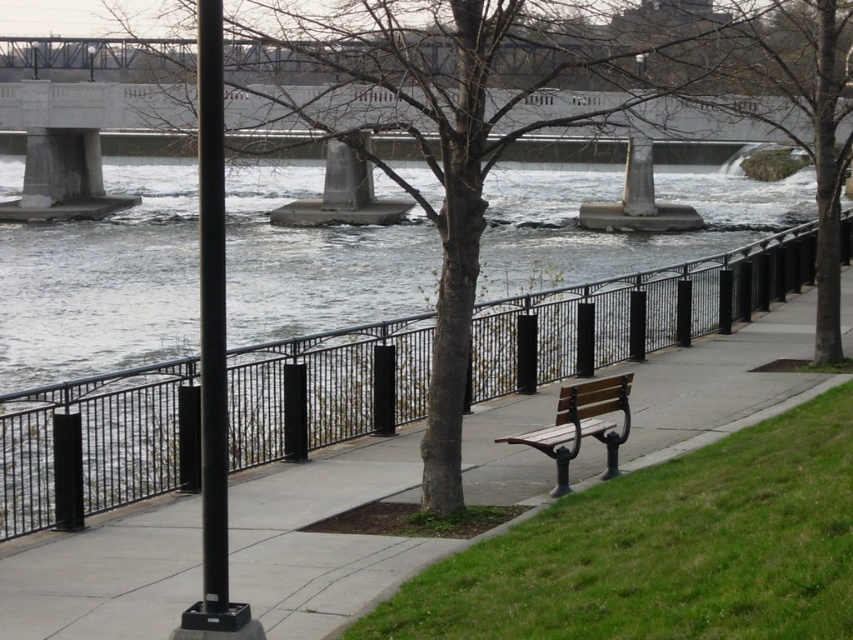
You are standing at the point marked by the coordinates point (630, 314) in the image. What object is directly in front of you?

The point (630, 314) indicates the black metal railing at center, so the object directly in front of you is the black metal railing at center.

You are standing on the riverside walkway and see two points marked in the image. Which point is closer to you, point (328, 378) or point (584, 390)?

Point (328, 378) is further to the camera than point (584, 390), so point (584, 390) is closer to you.

You are standing on the riverside walkway and want to take a photo of two points in the scene. The first point is at coordinates point (x=103, y=481) and the second point is at point (x=242, y=90). If you focus your camera on the closer point, will the farther point still be in focus?

Since point (x=103, y=481) is further to the camera than point (x=242, y=90), focusing on the closer point (x=242, y=90) would mean the farther point (x=103, y=481) might not be in focus. However, the question states focusing on the closer point, but according to the description, point 0.752 is further away. Wait, there seems confusion here. Let me recheck. The Objects Description says point 0.752 is further to the camera than point 0.141. So if you focus on the closer point 0.141, then the farther point 0.752 is